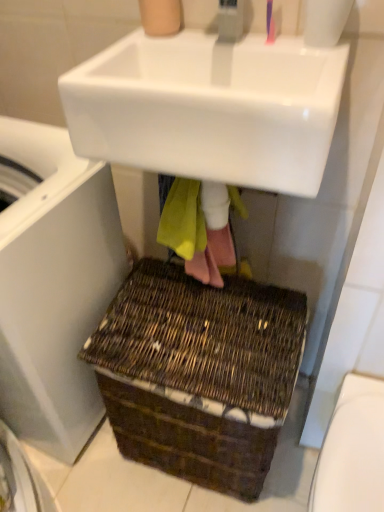
Locate an element on the screen. The height and width of the screenshot is (512, 384). free location above brown woven basket at lower center (from a real-world perspective) is located at coordinates pyautogui.click(x=187, y=327).